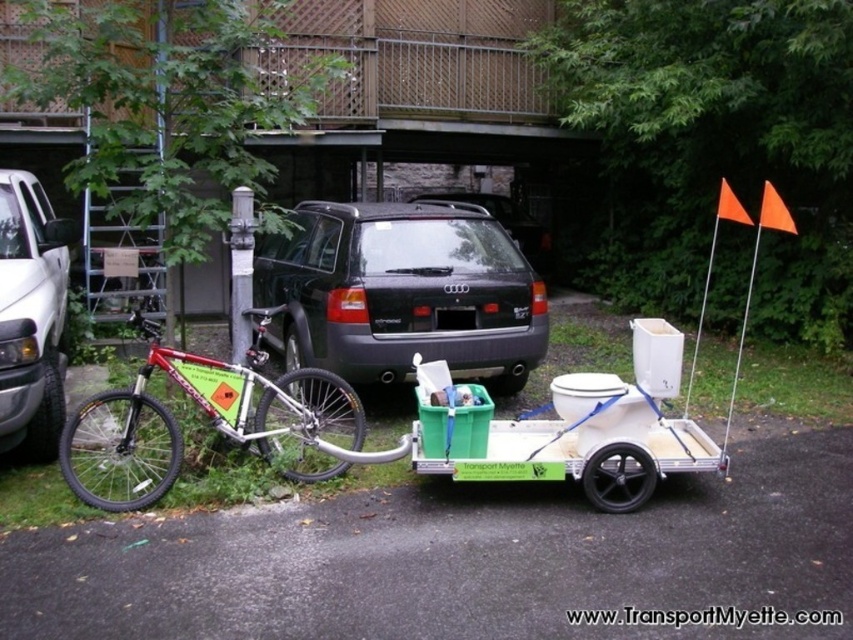
Which is more to the left, shiny metallic bicycle at left or white matte truck at left?

white matte truck at left

Measure the distance between shiny metallic bicycle at left and camera.

A distance of 4.77 meters exists between shiny metallic bicycle at left and camera.

At what (x,y) coordinates should I click in order to perform the action: click on shiny metallic bicycle at left. Please return your answer as a coordinate pair (x, y). This screenshot has width=853, height=640. Looking at the image, I should click on coord(206,413).

Does black matte suv at center have a larger size compared to shiny metallic bicycle at left?

Correct, black matte suv at center is larger in size than shiny metallic bicycle at left.

Is black matte suv at center above shiny metallic bicycle at left?

Correct, black matte suv at center is located above shiny metallic bicycle at left.

Is point (306, 342) less distant than point (141, 454)?

No, (306, 342) is behind (141, 454).

Identify the location of black matte suv at center. (402, 292).

You are a GUI agent. You are given a task and a screenshot of the screen. Output one action in this format:
    pyautogui.click(x=<x>, y=<y>)
    Task: Click on the black matte suv at center
    This screenshot has height=640, width=853.
    Given the screenshot: What is the action you would take?
    pyautogui.click(x=402, y=292)

Who is higher up, black matte suv at center or white matte truck at left?

black matte suv at center is above.

Describe the element at coordinates (402, 292) in the screenshot. This screenshot has height=640, width=853. I see `black matte suv at center` at that location.

Identify the location of black matte suv at center. The image size is (853, 640). (402, 292).